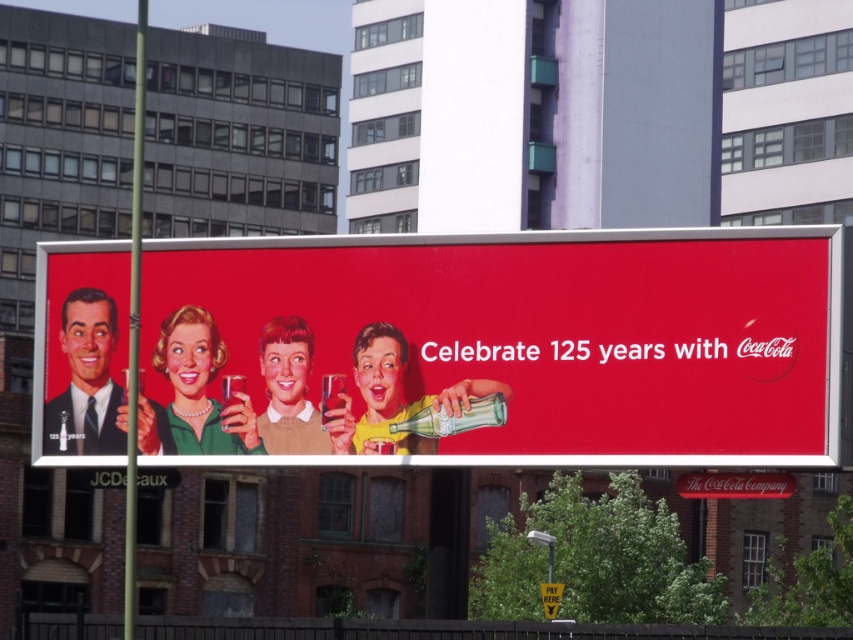
You are a photographer standing in front of the billboard and want to capture a photo where the matte green dress at center and the smooth plastic cup at center are both clearly visible. Based on their positions, which object should you ensure is in the frame first to avoid cropping?

The matte green dress at center is to the left of the smooth plastic cup at center, so you should ensure the matte green dress at center is in the frame first to avoid cropping the left side.

You are an architect designing a new building in the city. You need to place a new window that will allow a clear view of the Coca Cola logo on the billboard. The window will be placed at point [86,380]. However, there is an object at that point. What is the object blocking the view of the Coca Cola logo?

The object at point [86,380] is a matte black suit at left, which is blocking the view of the Coca Cola logo located in the bottom right corner of the billboard.

From the picture: You are a photographer standing in front of the billboard and want to capture both the matte black suit at left and the matte green dress at center in a single frame. Considering their sizes on the billboard, which one should you focus on to ensure both are visible without cropping?

The matte black suit at left is much taller than the matte green dress at center, so focusing on the taller matte black suit at left will ensure both are visible in the frame.